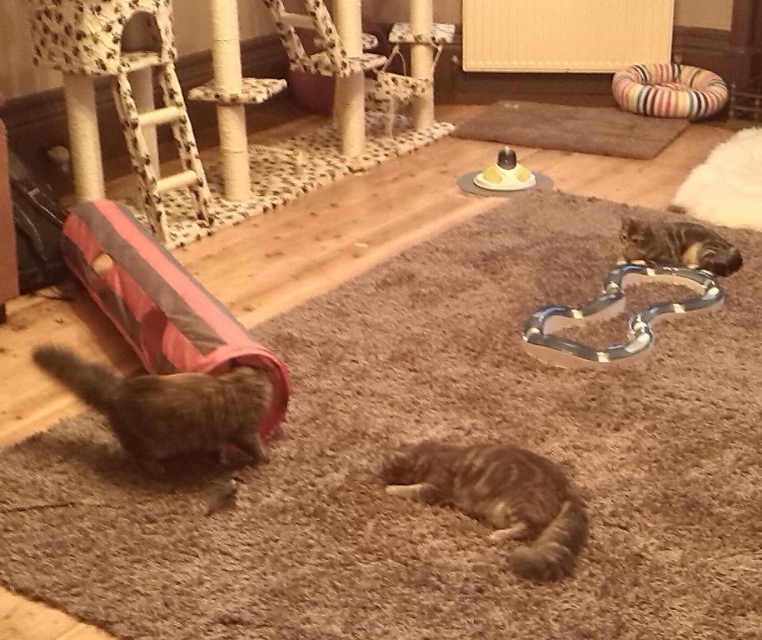
Can you confirm if gray tabby cat at center is bigger than metallic silver chain at upper right?

Incorrect, gray tabby cat at center is not larger than metallic silver chain at upper right.

Who is positioned more to the right, gray tabby cat at center or metallic silver chain at upper right?

From the viewer's perspective, metallic silver chain at upper right appears more on the right side.

Locate an element on the screen. gray tabby cat at center is located at coordinates (498, 497).

Locate an element on the screen. This screenshot has height=640, width=762. gray tabby cat at center is located at coordinates (498, 497).

Is gray tabby cat at center shorter than striped fur cat at right?

In fact, gray tabby cat at center may be taller than striped fur cat at right.

Between gray tabby cat at center and striped fur cat at right, which one has less height?

striped fur cat at right is shorter.

Between point (492, 493) and point (706, 269), which one is positioned in front?

Point (492, 493) is more forward.

Locate an element on the screen. The width and height of the screenshot is (762, 640). gray tabby cat at center is located at coordinates (498, 497).

Looking at this image, is gray fur cat at lower left bigger than metallic silver chain at upper right?

No.

Does point (125, 410) lie in front of point (712, 289)?

Yes, point (125, 410) is in front of point (712, 289).

Who is more distant from viewer, (138, 452) or (527, 340)?

The point (527, 340) is more distant.

At what (x,y) coordinates should I click in order to perform the action: click on gray fur cat at lower left. Please return your answer as a coordinate pair (x, y). The image size is (762, 640). Looking at the image, I should click on (167, 404).